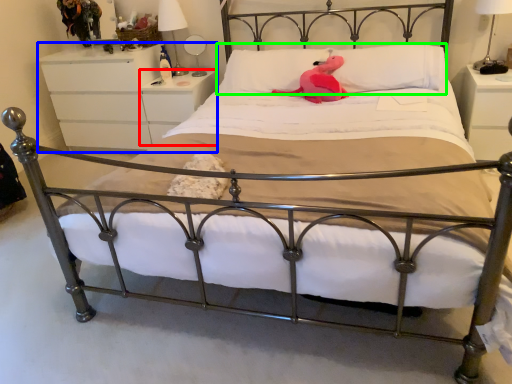
Question: Which object is the closest to the nightstand (highlighted by a red box)? Choose among these: nightstand (highlighted by a blue box) or pillow (highlighted by a green box).

Choices:
 (A) nightstand
 (B) pillow

Answer: (A)